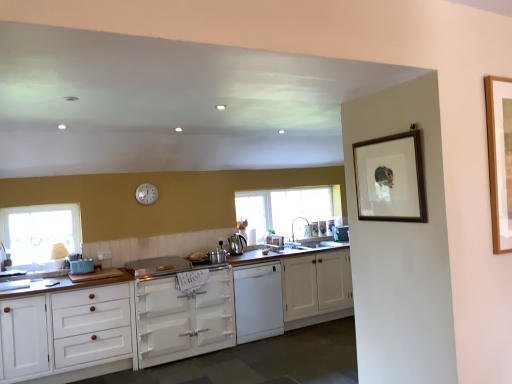
Question: From a real-world perspective, is white glossy dishwasher at center, the 3th appliance viewed from the left, physically located above or below clear glass window at center, arranged as the 2th window when viewed from the left?

Choices:
 (A) above
 (B) below

Answer: (B)

Question: Is white glossy dishwasher at center, the 3th appliance viewed from the left, to the left or to the right of clear glass window at center, which is the second window in front-to-back order, in the image?

Choices:
 (A) left
 (B) right

Answer: (A)

Question: Based on their relative distances, which object is farther from the clear glass window at left, which ranks as the first window in left-to-right order?

Choices:
 (A) white glossy sink at center, acting as the fourth appliance starting from the front
 (B) polished stainless steel kettle at center
 (C) satin nickel faucet at center
 (D) silver metallic pot at center, positioned as the second appliance in front-to-back order
 (E) teal matte toaster at lower left, the first appliance from the front

Answer: (A)

Question: Which is nearer to the white glossy sink at center, which is counted as the 5th appliance, starting from the front?

Choices:
 (A) satin nickel faucet at center
 (B) teal matte toaster at lower left, the first appliance from the front
 (C) silver metallic pot at center, positioned as the 5th appliance in right-to-left order
 (D) silver metallic gas stove at center
 (E) clear glass window at left, which ranks as the first window in left-to-right order

Answer: (A)